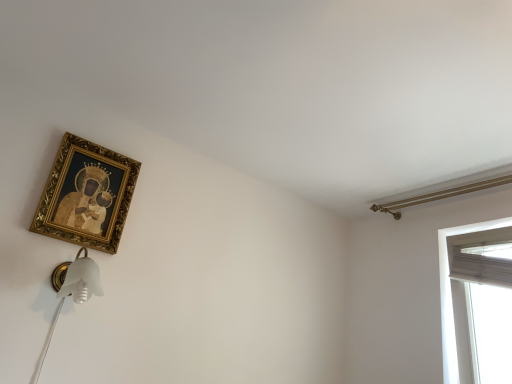
What is the approximate width of gold ornate frame at upper left?

It is 1.65 inches.

This screenshot has width=512, height=384. In order to click on gold ornate frame at upper left in this screenshot , I will do `click(86, 195)`.

The image size is (512, 384). What do you see at coordinates (86, 195) in the screenshot? I see `gold ornate frame at upper left` at bounding box center [86, 195].

In order to click on white sheer curtain at right in this screenshot , I will do `click(482, 265)`.

What do you see at coordinates (482, 265) in the screenshot? I see `white sheer curtain at right` at bounding box center [482, 265].

You are a GUI agent. You are given a task and a screenshot of the screen. Output one action in this format:
    pyautogui.click(x=<x>, y=<y>)
    Task: Click on the gold ornate frame at upper left
    
    Given the screenshot: What is the action you would take?
    pyautogui.click(x=86, y=195)

Which is more to the right, white sheer curtain at right or gold ornate frame at upper left?

From the viewer's perspective, white sheer curtain at right appears more on the right side.

Is white sheer curtain at right in front of or behind gold ornate frame at upper left in the image?

white sheer curtain at right is behind gold ornate frame at upper left.

Between point (511, 264) and point (88, 165), which one is positioned in front?

The point (88, 165) is closer to the camera.

From the image's perspective, is white sheer curtain at right located above or below gold ornate frame at upper left?

white sheer curtain at right is below gold ornate frame at upper left.

From a real-world perspective, which is physically below, white sheer curtain at right or gold ornate frame at upper left?

white sheer curtain at right, from a real-world perspective.

Can you confirm if white sheer curtain at right is wider than gold ornate frame at upper left?

Yes, white sheer curtain at right is wider than gold ornate frame at upper left.

From the picture: Is white sheer curtain at right taller than gold ornate frame at upper left?

No, white sheer curtain at right is not taller than gold ornate frame at upper left.

Who is smaller, white sheer curtain at right or gold ornate frame at upper left?

gold ornate frame at upper left.

Choose the correct answer: Is white sheer curtain at right inside gold ornate frame at upper left or outside it?

white sheer curtain at right is not inside gold ornate frame at upper left, it's outside.

Would you consider white sheer curtain at right to be distant from gold ornate frame at upper left?

white sheer curtain at right is far away from gold ornate frame at upper left.

Based on the photo, is white sheer curtain at right oriented towards gold ornate frame at upper left?

No.

Locate an element on the screen. This screenshot has width=512, height=384. curtain lying behind the gold ornate frame at upper left is located at coordinates (482, 265).

In the image, is gold ornate frame at upper left on the left side or the right side of white sheer curtain at right?

gold ornate frame at upper left is positioned on white sheer curtain at right's left side.

Considering the positions of objects gold ornate frame at upper left and white sheer curtain at right in the image provided, who is behind, gold ornate frame at upper left or white sheer curtain at right?

white sheer curtain at right is behind.

Which point is more forward, (113, 249) or (494, 280)?

The point (113, 249) is more forward.

Looking at this image, from the image's perspective, is gold ornate frame at upper left above or below white sheer curtain at right?

Based on their image positions, gold ornate frame at upper left is located above white sheer curtain at right.

From a real-world perspective, relative to white sheer curtain at right, is gold ornate frame at upper left vertically above or below?

From a real-world perspective, gold ornate frame at upper left is physically above white sheer curtain at right.

In terms of width, does gold ornate frame at upper left look wider or thinner when compared to white sheer curtain at right?

Considering their sizes, gold ornate frame at upper left looks slimmer than white sheer curtain at right.

From their relative heights in the image, would you say gold ornate frame at upper left is taller or shorter than white sheer curtain at right?

gold ornate frame at upper left is taller than white sheer curtain at right.

Which of these two, gold ornate frame at upper left or white sheer curtain at right, is bigger?

white sheer curtain at right is bigger.

Is gold ornate frame at upper left not within white sheer curtain at right?

gold ornate frame at upper left lies outside white sheer curtain at right's area.

Are gold ornate frame at upper left and white sheer curtain at right making contact?

No.

Is gold ornate frame at upper left looking in the opposite direction of white sheer curtain at right?

No, gold ornate frame at upper left's orientation is not away from white sheer curtain at right.

At what (x,y) coordinates should I click in order to perform the action: click on curtain below the gold ornate frame at upper left (from the image's perspective). Please return your answer as a coordinate pair (x, y). Image resolution: width=512 pixels, height=384 pixels. Looking at the image, I should click on (482, 265).

Locate an element on the screen. This screenshot has height=384, width=512. curtain located underneath the gold ornate frame at upper left (from a real-world perspective) is located at coordinates (482, 265).

Find the location of a particular element. picture frame on the left of white sheer curtain at right is located at coordinates (86, 195).